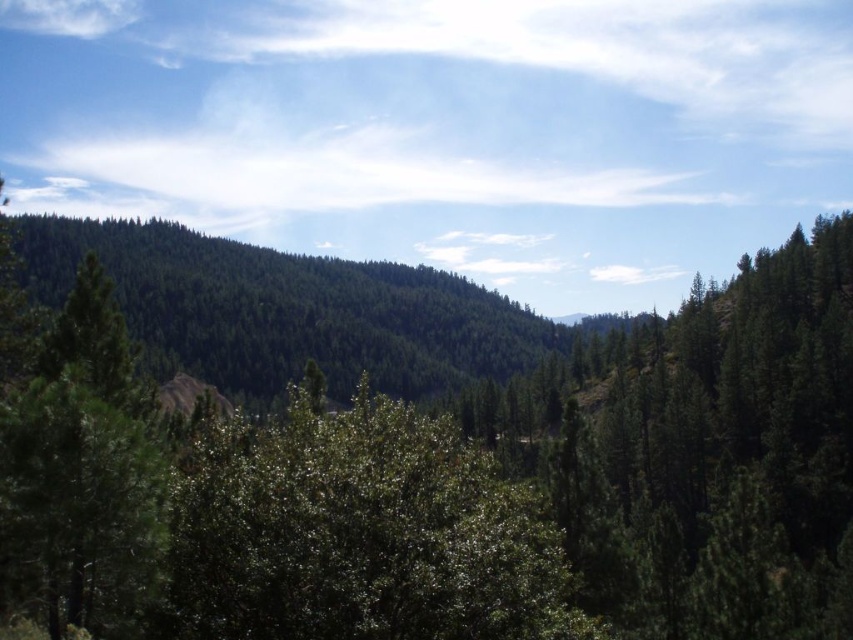
Question: In this image, where is green leafy forest at center located relative to green leafy tree at center?

Choices:
 (A) above
 (B) below

Answer: (A)

Question: Is green leafy forest at center smaller than green leafy tree at center?

Choices:
 (A) yes
 (B) no

Answer: (B)

Question: Does green leafy forest at center have a smaller size compared to green leafy tree at center?

Choices:
 (A) no
 (B) yes

Answer: (A)

Question: Which of the following is the closest to the observer?

Choices:
 (A) green leafy tree at center
 (B) green leafy forest at center

Answer: (B)